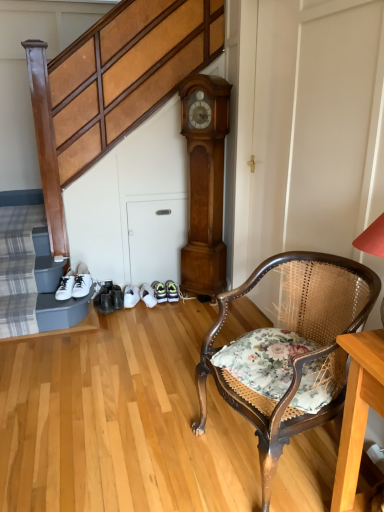
What are the coordinates of `vacant area that lies in front of light brown wood clock at center` in the screenshot? It's located at (193, 313).